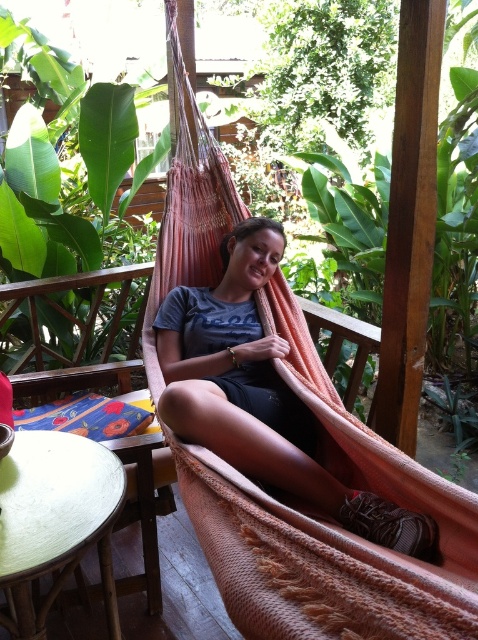
Between matte pink hammock at center and wooden chair at center, which one has less height?

wooden chair at center is shorter.

Can you confirm if matte pink hammock at center is wider than wooden chair at center?

Yes.

Does point (381, 528) come closer to viewer compared to point (132, 278)?

Yes, point (381, 528) is in front of point (132, 278).

Locate an element on the screen. The image size is (478, 640). matte pink hammock at center is located at coordinates (259, 394).

Who is shorter, pink woven hammock at center or wooden chair at center?

With less height is wooden chair at center.

Can you confirm if pink woven hammock at center is bigger than wooden chair at center?

Yes, pink woven hammock at center is bigger than wooden chair at center.

This screenshot has width=478, height=640. What do you see at coordinates (328, 525) in the screenshot?
I see `pink woven hammock at center` at bounding box center [328, 525].

Image resolution: width=478 pixels, height=640 pixels. What are the coordinates of `pink woven hammock at center` in the screenshot? It's located at (328, 525).

Which is below, pink woven hammock at center or matte pink hammock at center?

matte pink hammock at center is below.

Who is higher up, pink woven hammock at center or matte pink hammock at center?

pink woven hammock at center is above.

Is point (187, 97) closer to viewer compared to point (279, 339)?

No, (187, 97) is behind (279, 339).

Locate an element on the screen. This screenshot has height=640, width=478. pink woven hammock at center is located at coordinates point(328,525).